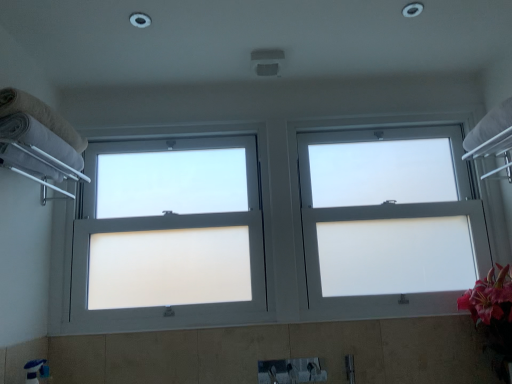
Question: Is white frosted glass window at center, the 2th window when ordered from left to right, shorter than beige cotton towel at left, arranged as the 1th towel when viewed from the top?

Choices:
 (A) no
 (B) yes

Answer: (A)

Question: Is white frosted glass window at center, which is the first window from right to left, wider than beige cotton towel at left, arranged as the 1th towel when viewed from the top?

Choices:
 (A) yes
 (B) no

Answer: (B)

Question: Is white frosted glass window at center, which is the first window from right to left, to the left of beige cotton towel at left, positioned as the 2th towel in bottom-to-top order, from the viewer's perspective?

Choices:
 (A) yes
 (B) no

Answer: (B)

Question: Is white frosted glass window at center, the 2th window when ordered from left to right, to the right of beige cotton towel at left, positioned as the 2th towel in bottom-to-top order, from the viewer's perspective?

Choices:
 (A) yes
 (B) no

Answer: (A)

Question: Is beige cotton towel at left, arranged as the 1th towel when viewed from the top, at the back of white frosted glass window at center, which is the first window from right to left?

Choices:
 (A) no
 (B) yes

Answer: (A)

Question: Is beige cotton towel at left, arranged as the 1th towel when viewed from the top, bigger or smaller than white frosted glass window at center, the 2th window when ordered from left to right?

Choices:
 (A) big
 (B) small

Answer: (B)

Question: Considering the positions of point (15, 97) and point (435, 155), is point (15, 97) closer or farther from the camera than point (435, 155)?

Choices:
 (A) closer
 (B) farther

Answer: (A)

Question: In the image, is beige cotton towel at left, arranged as the 1th towel when viewed from the top, positioned in front of or behind white frosted glass window at center, which is the first window from right to left?

Choices:
 (A) front
 (B) behind

Answer: (A)

Question: Which is correct: beige cotton towel at left, arranged as the 1th towel when viewed from the top, is inside white frosted glass window at center, the 2th window when ordered from left to right, or outside of it?

Choices:
 (A) inside
 (B) outside

Answer: (B)

Question: Visually, is white frosted glass window at center, which is the 2th window in right-to-left order, positioned to the left or to the right of white fluffy towel at left, the first towel positioned from the bottom?

Choices:
 (A) left
 (B) right

Answer: (B)

Question: Is white frosted glass window at center, which is the 2th window in right-to-left order, in front of or behind white fluffy towel at left, the second towel from the top, in the image?

Choices:
 (A) front
 (B) behind

Answer: (B)

Question: Is white frosted glass window at center, which is the 2th window in right-to-left order, situated inside white fluffy towel at left, the first towel positioned from the bottom, or outside?

Choices:
 (A) outside
 (B) inside

Answer: (A)

Question: From the image's perspective, is white frosted glass window at center, which is the 2th window in right-to-left order, located above or below white fluffy towel at left, the second towel from the top?

Choices:
 (A) below
 (B) above

Answer: (A)

Question: From a real-world perspective, is white frosted glass window at center, which is the 2th window in right-to-left order, above or below beige cotton towel at left, arranged as the 1th towel when viewed from the top?

Choices:
 (A) below
 (B) above

Answer: (A)

Question: Considering the positions of white frosted glass window at center, the 1th window viewed from the left, and beige cotton towel at left, positioned as the 2th towel in bottom-to-top order, in the image, is white frosted glass window at center, the 1th window viewed from the left, wider or thinner than beige cotton towel at left, positioned as the 2th towel in bottom-to-top order,?

Choices:
 (A) wide
 (B) thin

Answer: (B)